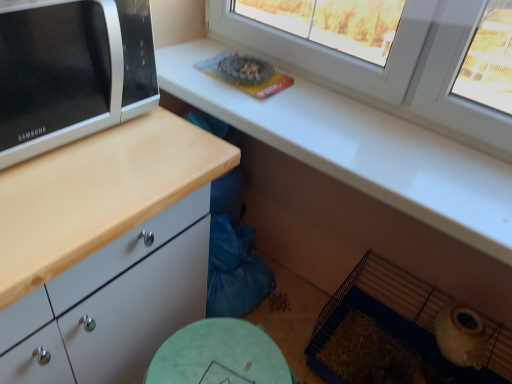
Question: Is white plastic window at upper center to the right of white glossy microwave at left from the viewer's perspective?

Choices:
 (A) yes
 (B) no

Answer: (A)

Question: Does white plastic window at upper center have a smaller size compared to white glossy microwave at left?

Choices:
 (A) yes
 (B) no

Answer: (A)

Question: From the image's perspective, is white plastic window at upper center under white glossy microwave at left?

Choices:
 (A) no
 (B) yes

Answer: (A)

Question: Is white plastic window at upper center looking in the opposite direction of white glossy microwave at left?

Choices:
 (A) yes
 (B) no

Answer: (B)

Question: Are white plastic window at upper center and white glossy microwave at left located far from each other?

Choices:
 (A) yes
 (B) no

Answer: (B)

Question: From a real-world perspective, is white plastic window at upper center on white glossy microwave at left?

Choices:
 (A) no
 (B) yes

Answer: (A)

Question: Is white glossy microwave at left outside white plastic window at upper center?

Choices:
 (A) no
 (B) yes

Answer: (B)

Question: Does white glossy microwave at left have a lesser height compared to white plastic window at upper center?

Choices:
 (A) yes
 (B) no

Answer: (A)

Question: From the image's perspective, is white glossy microwave at left on top of white plastic window at upper center?

Choices:
 (A) yes
 (B) no

Answer: (B)

Question: Considering the relative sizes of white glossy microwave at left and white plastic window at upper center in the image provided, is white glossy microwave at left bigger than white plastic window at upper center?

Choices:
 (A) no
 (B) yes

Answer: (B)

Question: Considering the relative sizes of white glossy microwave at left and white plastic window at upper center in the image provided, is white glossy microwave at left wider than white plastic window at upper center?

Choices:
 (A) yes
 (B) no

Answer: (A)

Question: Are white glossy microwave at left and white plastic window at upper center far apart?

Choices:
 (A) yes
 (B) no

Answer: (B)

Question: Considering the positions of white plastic window at upper center and white glossy microwave at left in the image, is white plastic window at upper center bigger or smaller than white glossy microwave at left?

Choices:
 (A) small
 (B) big

Answer: (A)